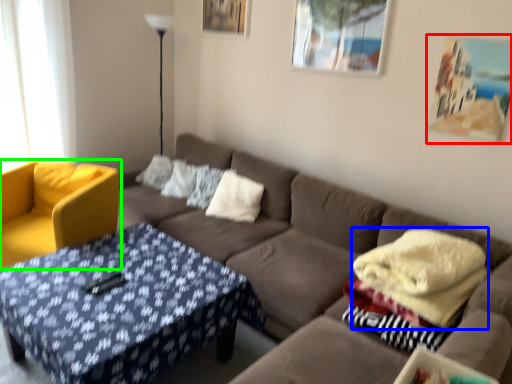
Question: Which is farther away from picture frame (highlighted by a red box)? blanket (highlighted by a blue box) or chair (highlighted by a green box)?

Choices:
 (A) blanket
 (B) chair

Answer: (B)